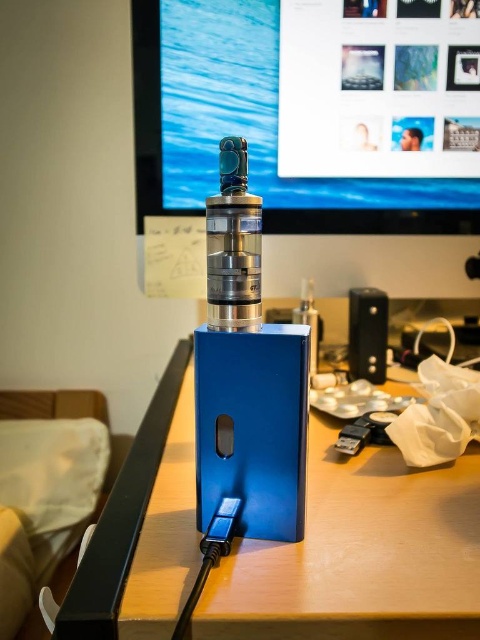
Question: Is matte black monitor at upper center closer to camera compared to blue metallic box at center?

Choices:
 (A) yes
 (B) no

Answer: (B)

Question: Does matte black monitor at upper center have a lesser width compared to black plastic speaker at right?

Choices:
 (A) yes
 (B) no

Answer: (B)

Question: Estimate the real-world distances between objects in this image. Which object is closer to the blue metallic box at center?

Choices:
 (A) matte black monitor at upper center
 (B) black plastic speaker at right

Answer: (B)

Question: Which of these objects is positioned closest to the matte black monitor at upper center?

Choices:
 (A) black plastic speaker at right
 (B) blue metallic box at center

Answer: (A)

Question: Which object is positioned farthest from the black plastic speaker at right?

Choices:
 (A) blue metallic box at center
 (B) matte black monitor at upper center

Answer: (A)

Question: Is blue metallic box at center wider than black plastic speaker at right?

Choices:
 (A) no
 (B) yes

Answer: (B)